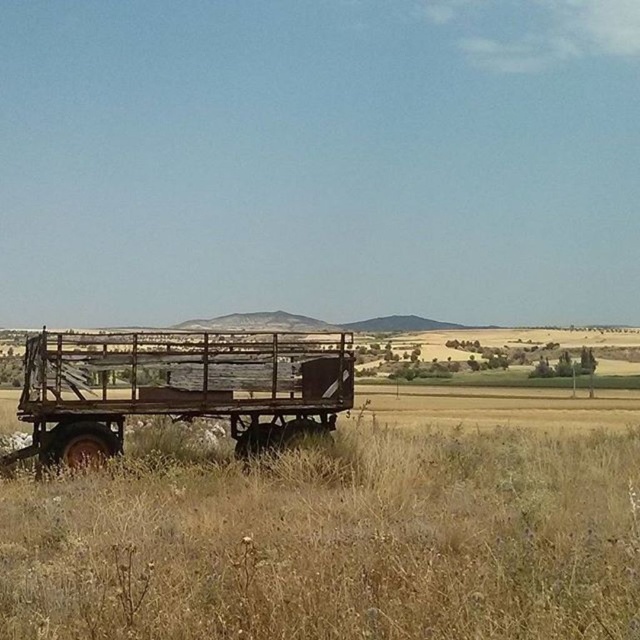
Question: Can you confirm if dry grass at lower center is wider than rusty metal wagon at center?

Choices:
 (A) no
 (B) yes

Answer: (B)

Question: Can you confirm if dry grass at lower center is wider than rusty metal wagon at center?

Choices:
 (A) no
 (B) yes

Answer: (B)

Question: Which object is farther from the camera taking this photo?

Choices:
 (A) rusty metal wagon at center
 (B) dry grass at lower center

Answer: (A)

Question: Does dry grass at lower center appear under rusty metal wagon at center?

Choices:
 (A) no
 (B) yes

Answer: (B)